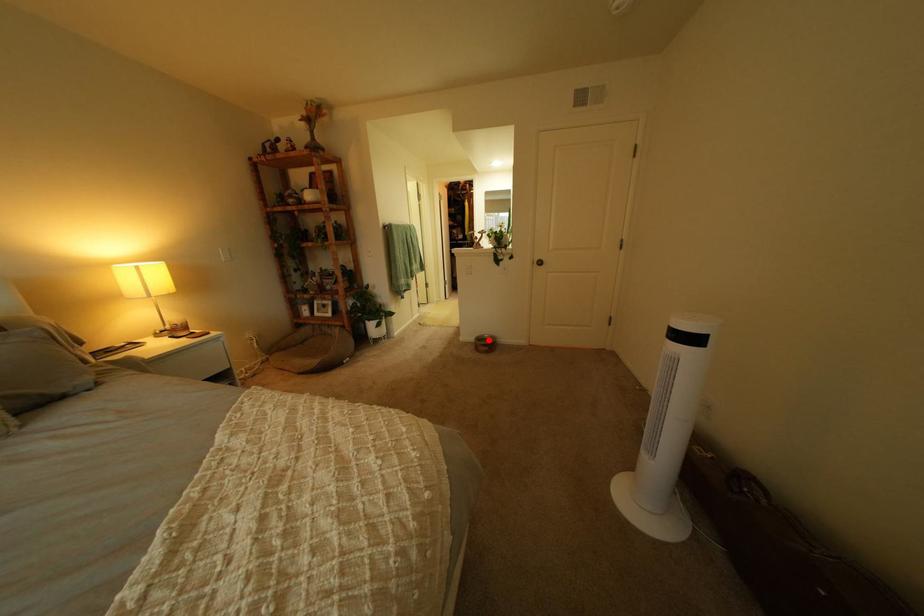
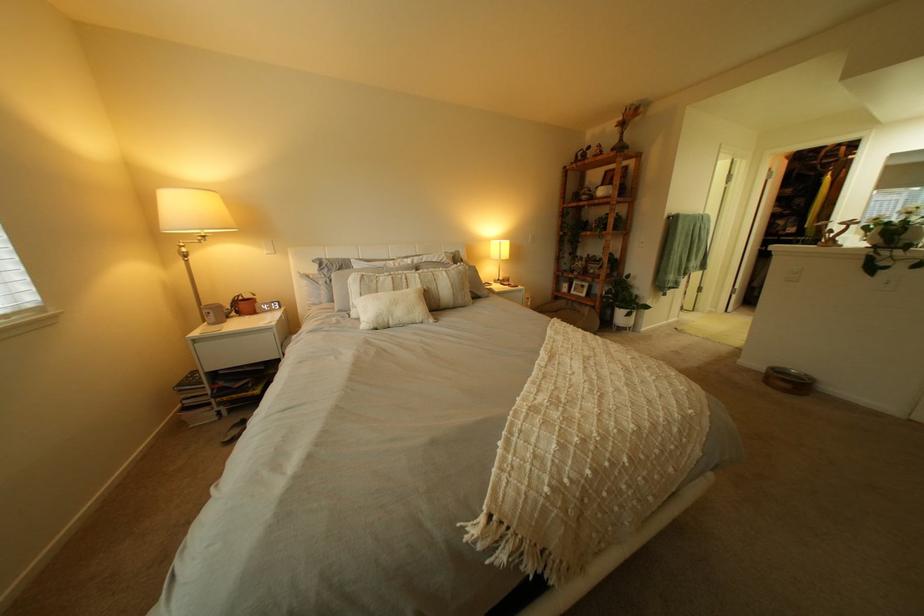
Find the pixel in the second image that matches the highlighted location in the first image.

(779, 369)